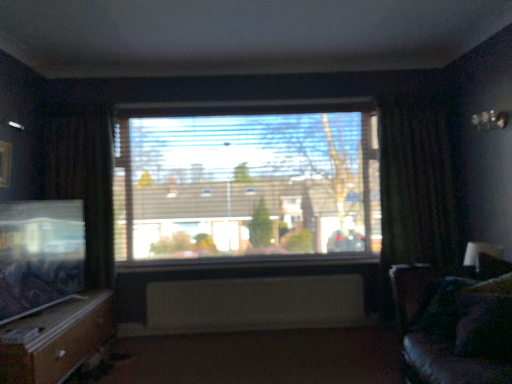
Question: From a real-world perspective, is white textured radiator at center positioned over dark brown fabric curtain at left, which is the 1th curtain from left to right, based on gravity?

Choices:
 (A) no
 (B) yes

Answer: (A)

Question: Would you say white textured radiator at center is outside dark brown fabric curtain at left, which is counted as the 2th curtain, starting from the right?

Choices:
 (A) yes
 (B) no

Answer: (A)

Question: Is the depth of white textured radiator at center less than that of dark brown fabric curtain at left, which is counted as the 2th curtain, starting from the right?

Choices:
 (A) no
 (B) yes

Answer: (A)

Question: Is dark brown fabric curtain at left, which is the 1th curtain from left to right, surrounded by white textured radiator at center?

Choices:
 (A) yes
 (B) no

Answer: (B)

Question: From a real-world perspective, is white textured radiator at center below dark brown fabric curtain at left, which is the 1th curtain from left to right?

Choices:
 (A) no
 (B) yes

Answer: (B)

Question: Can you confirm if white textured radiator at center is positioned to the left of dark brown fabric curtain at left, which is counted as the 2th curtain, starting from the right?

Choices:
 (A) yes
 (B) no

Answer: (B)

Question: Is velvet dark blue pillow at lower right further to the viewer compared to velvet dark brown couch at right?

Choices:
 (A) yes
 (B) no

Answer: (A)

Question: From a real-world perspective, does velvet dark blue pillow at lower right stand above velvet dark brown couch at right?

Choices:
 (A) no
 (B) yes

Answer: (B)

Question: Is velvet dark blue pillow at lower right positioned with its back to velvet dark brown couch at right?

Choices:
 (A) no
 (B) yes

Answer: (B)

Question: Can we say velvet dark blue pillow at lower right lies outside velvet dark brown couch at right?

Choices:
 (A) yes
 (B) no

Answer: (B)

Question: Considering the relative positions of velvet dark blue pillow at lower right and velvet dark brown couch at right in the image provided, is velvet dark blue pillow at lower right in front of velvet dark brown couch at right?

Choices:
 (A) yes
 (B) no

Answer: (B)

Question: From the image's perspective, is velvet dark blue pillow at lower right on velvet dark brown couch at right?

Choices:
 (A) yes
 (B) no

Answer: (A)

Question: From a real-world perspective, is white painted wood at center physically above white textured radiator at center?

Choices:
 (A) yes
 (B) no

Answer: (A)